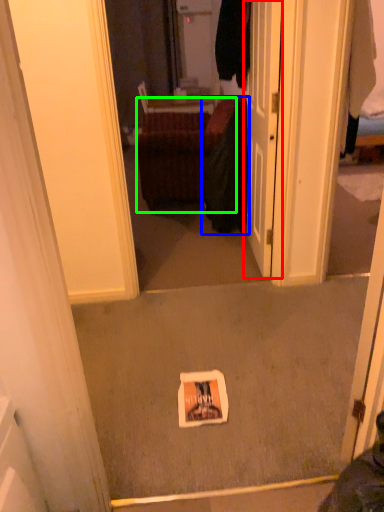
Question: Which object is positioned farthest from door (highlighted by a red box)? Select from clothing (highlighted by a blue box) and furniture (highlighted by a green box).

Choices:
 (A) clothing
 (B) furniture

Answer: (B)